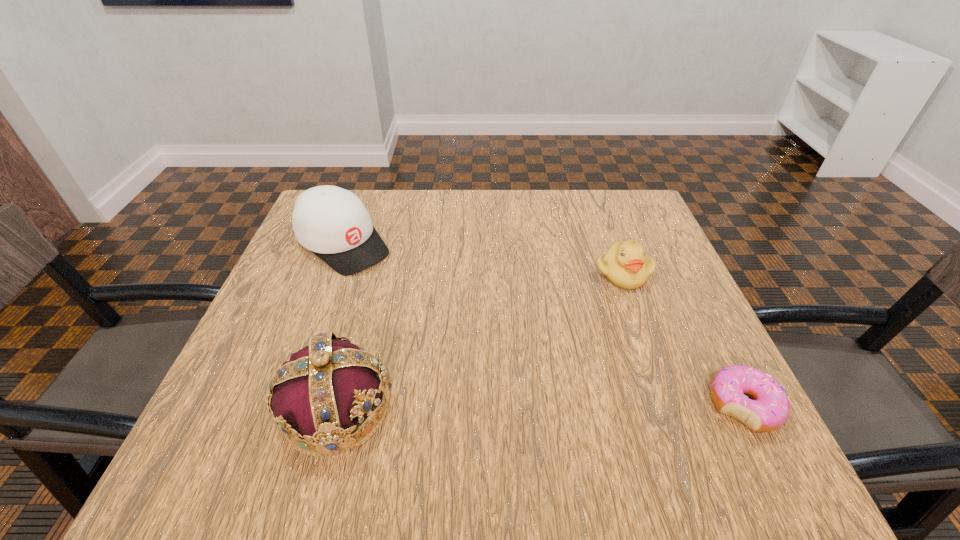
I want to click on duckling present at the right edge, so click(x=625, y=265).

The width and height of the screenshot is (960, 540). In order to click on object that is at the far left corner in this screenshot , I will do `click(333, 223)`.

I want to click on object situated at the near left corner, so click(319, 395).

Locate an element on the screen. object that is at the near right corner is located at coordinates (769, 410).

This screenshot has height=540, width=960. In the image, there is a desktop. In order to click on vacant space at the far edge in this screenshot , I will do `click(471, 190)`.

This screenshot has width=960, height=540. In order to click on vacant space at the near edge in this screenshot , I will do `click(436, 414)`.

The image size is (960, 540). I want to click on vacant region at the left edge of the desktop, so click(306, 275).

You are a GUI agent. You are given a task and a screenshot of the screen. Output one action in this format:
    pyautogui.click(x=<x>, y=<y>)
    Task: Click on the vacant point at the right edge
    
    Given the screenshot: What is the action you would take?
    pyautogui.click(x=648, y=321)

You are a GUI agent. You are given a task and a screenshot of the screen. Output one action in this format:
    pyautogui.click(x=<x>, y=<y>)
    Task: Click on the vacant space at the far right corner
    
    Given the screenshot: What is the action you would take?
    pyautogui.click(x=598, y=231)

Where is `unoccupied area between the crown and the duckling`? This screenshot has width=960, height=540. unoccupied area between the crown and the duckling is located at coordinates (479, 341).